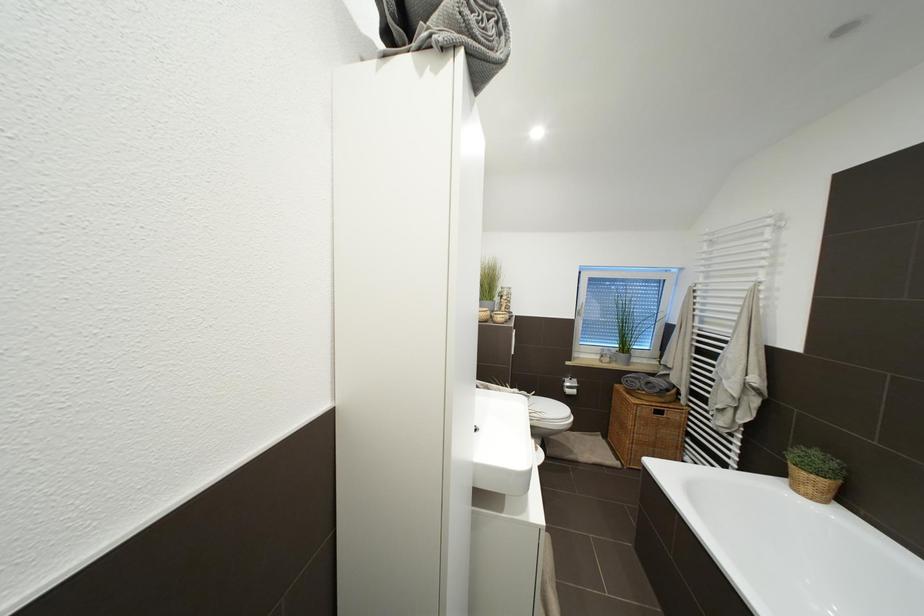
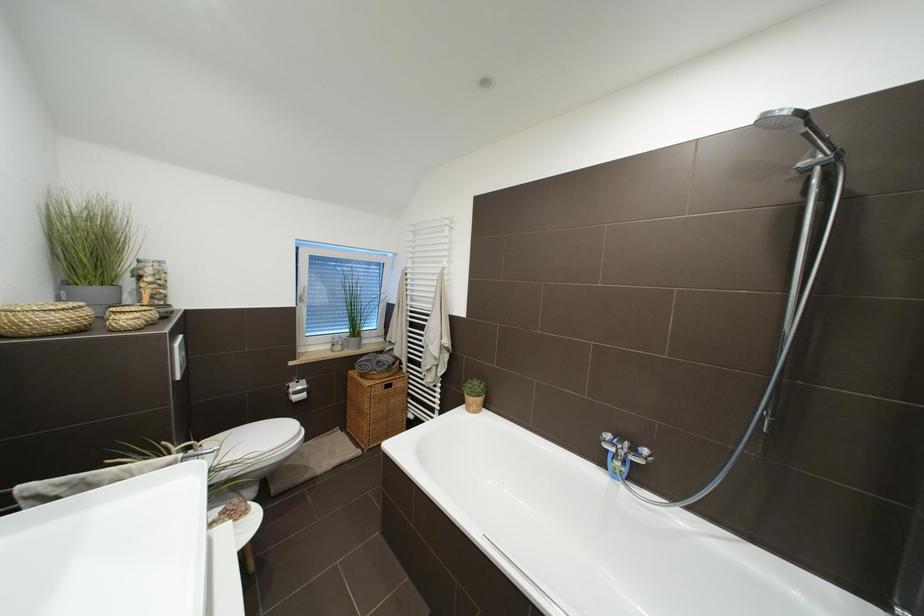
Question: Based on the continuous images, in which direction is the camera rotating? Reply with the corresponding letter.

Choices:
 (A) Left
 (B) Right
 (C) Up
 (D) Down

Answer: (B)